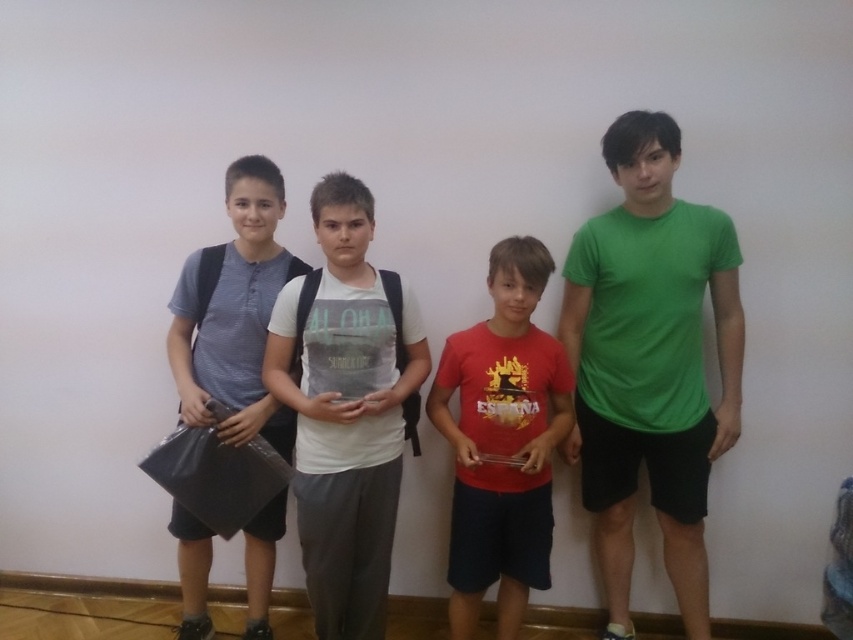
Question: Which point is closer to the camera?

Choices:
 (A) (238, 340)
 (B) (651, 188)
 (C) (361, 346)

Answer: (C)

Question: Can you confirm if red matte shirt at center is positioned to the right of matte black bag at left?

Choices:
 (A) yes
 (B) no

Answer: (A)

Question: Which of the following is the farthest from the observer?

Choices:
 (A) (347, 369)
 (B) (210, 285)
 (C) (648, 468)

Answer: (C)

Question: Is white cotton t-shirt at center smaller than red matte shirt at center?

Choices:
 (A) no
 (B) yes

Answer: (B)

Question: Which point is farther to the camera?

Choices:
 (A) green matte t-shirt at right
 (B) matte black bag at left

Answer: (B)

Question: Considering the relative positions of red matte shirt at center and matte black bag at left in the image provided, where is red matte shirt at center located with respect to matte black bag at left?

Choices:
 (A) above
 (B) below

Answer: (B)